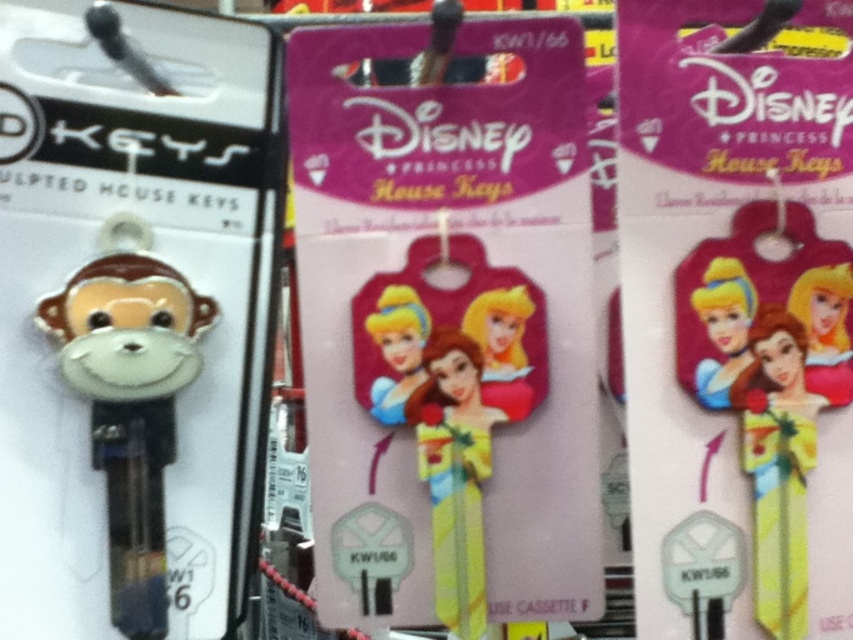
Can you confirm if glossy plastic princess at center is wider than black plastic hook at upper left?

No, glossy plastic princess at center is not wider than black plastic hook at upper left.

Is glossy plastic princess at center to the right of black plastic hook at upper left from the viewer's perspective?

Correct, you'll find glossy plastic princess at center to the right of black plastic hook at upper left.

Between point (381, 388) and point (99, 20), which one is positioned behind?

Point (381, 388)

Where is `glossy plastic princess at center`? glossy plastic princess at center is located at coordinates (397, 349).

Is yellow matte doll at center to the left of black plastic hook at upper left from the viewer's perspective?

No, yellow matte doll at center is not to the left of black plastic hook at upper left.

Between yellow matte doll at center and black plastic hook at upper left, which one is positioned higher?

black plastic hook at upper left is higher up.

Who is more distant from viewer, (741, 390) or (126, 51)?

The point (126, 51) is behind.

Where is `yellow matte doll at center`? This screenshot has width=853, height=640. yellow matte doll at center is located at coordinates (780, 461).

Who is higher up, matte black keychain monkey at left or glossy plastic princess at center?

Positioned higher is glossy plastic princess at center.

Between matte black keychain monkey at left and glossy plastic princess at center, which one appears on the right side from the viewer's perspective?

Positioned to the right is glossy plastic princess at center.

The height and width of the screenshot is (640, 853). In order to click on matte black keychain monkey at left in this screenshot , I will do `click(131, 406)`.

Where is `matte black keychain monkey at left`? matte black keychain monkey at left is located at coordinates (131, 406).